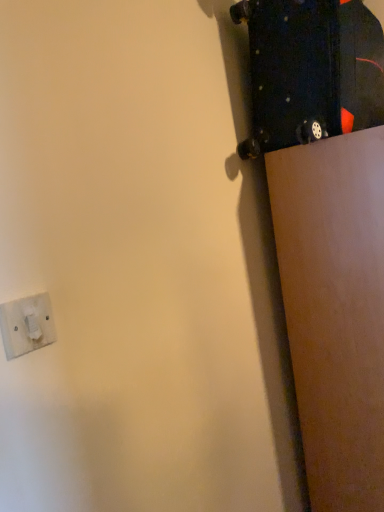
Locate an element on the screen. The width and height of the screenshot is (384, 512). white plastic socket at lower left is located at coordinates (27, 325).

What do you see at coordinates (27, 325) in the screenshot?
I see `white plastic socket at lower left` at bounding box center [27, 325].

The width and height of the screenshot is (384, 512). In order to click on black matte skateboard at upper right in this screenshot , I will do `click(311, 70)`.

Describe the element at coordinates (311, 70) in the screenshot. This screenshot has width=384, height=512. I see `black matte skateboard at upper right` at that location.

This screenshot has width=384, height=512. In order to click on white plastic socket at lower left in this screenshot , I will do `click(27, 325)`.

Is black matte skateboard at upper right to the right of white plastic socket at lower left from the viewer's perspective?

Yes, black matte skateboard at upper right is to the right of white plastic socket at lower left.

Looking at this image, considering the positions of objects black matte skateboard at upper right and white plastic socket at lower left in the image provided, who is behind, black matte skateboard at upper right or white plastic socket at lower left?

black matte skateboard at upper right is behind.

Which is in front, point (263, 140) or point (7, 323)?

The point (7, 323) is more forward.

From the image's perspective, would you say black matte skateboard at upper right is shown under white plastic socket at lower left?

Actually, black matte skateboard at upper right appears above white plastic socket at lower left in the image.

From a real-world perspective, is black matte skateboard at upper right above or below white plastic socket at lower left?

black matte skateboard at upper right is situated higher than white plastic socket at lower left in the real world.

Looking at this image, considering the sizes of objects black matte skateboard at upper right and white plastic socket at lower left in the image provided, who is thinner, black matte skateboard at upper right or white plastic socket at lower left?

white plastic socket at lower left.

Who is taller, black matte skateboard at upper right or white plastic socket at lower left?

Standing taller between the two is black matte skateboard at upper right.

Does black matte skateboard at upper right have a larger size compared to white plastic socket at lower left?

Correct, black matte skateboard at upper right is larger in size than white plastic socket at lower left.

Is black matte skateboard at upper right not within white plastic socket at lower left?

That's correct, black matte skateboard at upper right is outside of white plastic socket at lower left.

Are black matte skateboard at upper right and white plastic socket at lower left far apart?

Yes, black matte skateboard at upper right is far from white plastic socket at lower left.

Is black matte skateboard at upper right looking in the opposite direction of white plastic socket at lower left?

black matte skateboard at upper right is not turned away from white plastic socket at lower left.

Where is `skateboard that appears above the white plastic socket at lower left (from a real-world perspective)`? skateboard that appears above the white plastic socket at lower left (from a real-world perspective) is located at coordinates (311, 70).

Which object is positioned more to the right, white plastic socket at lower left or black matte skateboard at upper right?

Positioned to the right is black matte skateboard at upper right.

Which object is more forward, white plastic socket at lower left or black matte skateboard at upper right?

white plastic socket at lower left.

Which is less distant, (x=17, y=354) or (x=305, y=126)?

Point (x=17, y=354) is positioned closer to the camera compared to point (x=305, y=126).

From the image's perspective, which is below, white plastic socket at lower left or black matte skateboard at upper right?

white plastic socket at lower left, from the image's perspective.

From a real-world perspective, who is located higher, white plastic socket at lower left or black matte skateboard at upper right?

From a 3D spatial view, black matte skateboard at upper right is above.

Consider the image. Which of these two, white plastic socket at lower left or black matte skateboard at upper right, is wider?

With larger width is black matte skateboard at upper right.

Based on the photo, which of these two, white plastic socket at lower left or black matte skateboard at upper right, stands taller?

With more height is black matte skateboard at upper right.

Between white plastic socket at lower left and black matte skateboard at upper right, which one has larger size?

Bigger between the two is black matte skateboard at upper right.

Is white plastic socket at lower left situated inside black matte skateboard at upper right or outside?

white plastic socket at lower left lies outside black matte skateboard at upper right.

Is the surface of white plastic socket at lower left in direct contact with black matte skateboard at upper right?

No, white plastic socket at lower left is not making contact with black matte skateboard at upper right.

Does white plastic socket at lower left turn towards black matte skateboard at upper right?

No.

Find the location of a particular element. socket in front of the black matte skateboard at upper right is located at coordinates (x=27, y=325).

Where is `skateboard that is behind the white plastic socket at lower left`? This screenshot has width=384, height=512. skateboard that is behind the white plastic socket at lower left is located at coordinates (311, 70).

Identify the location of socket below the black matte skateboard at upper right (from a real-world perspective). 27,325.